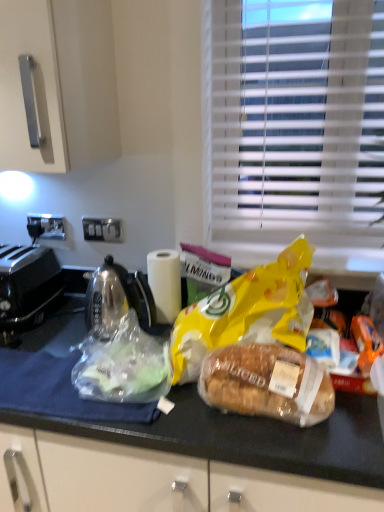
Where is `free point below white plastic blinds at upper right (from a real-world perspective)`? free point below white plastic blinds at upper right (from a real-world perspective) is located at coordinates [x=286, y=244].